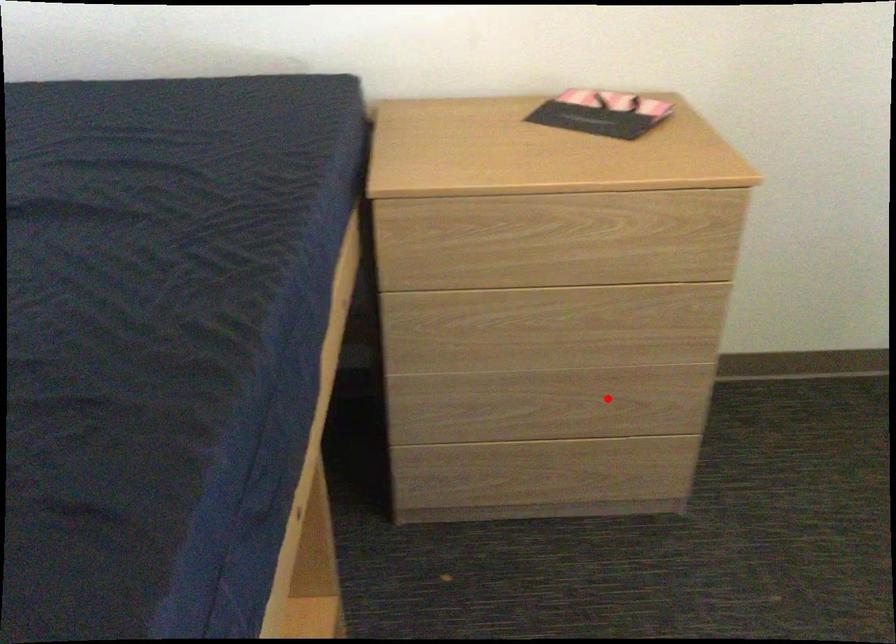
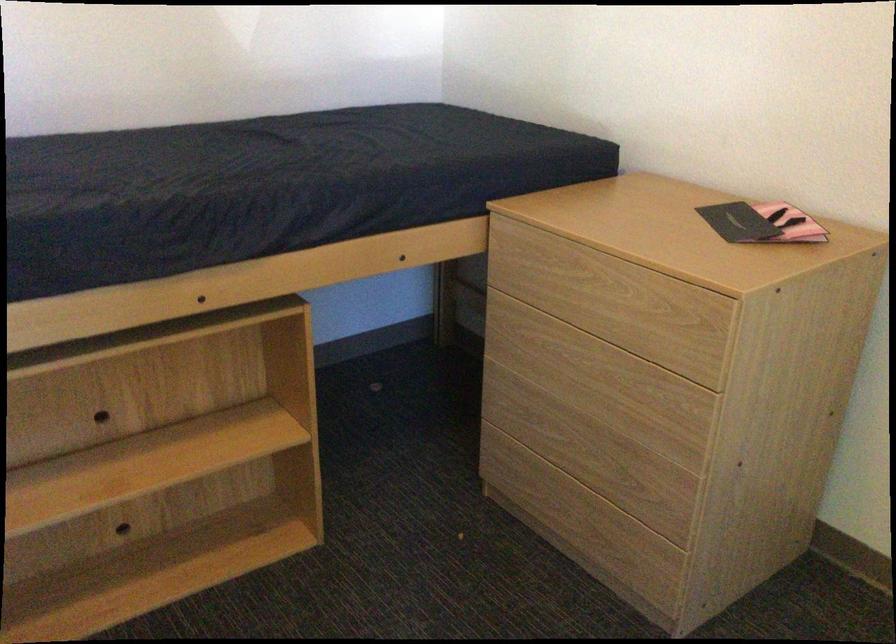
Where in the second image is the point corresponding to the highlighted location from the first image?

(607, 464)